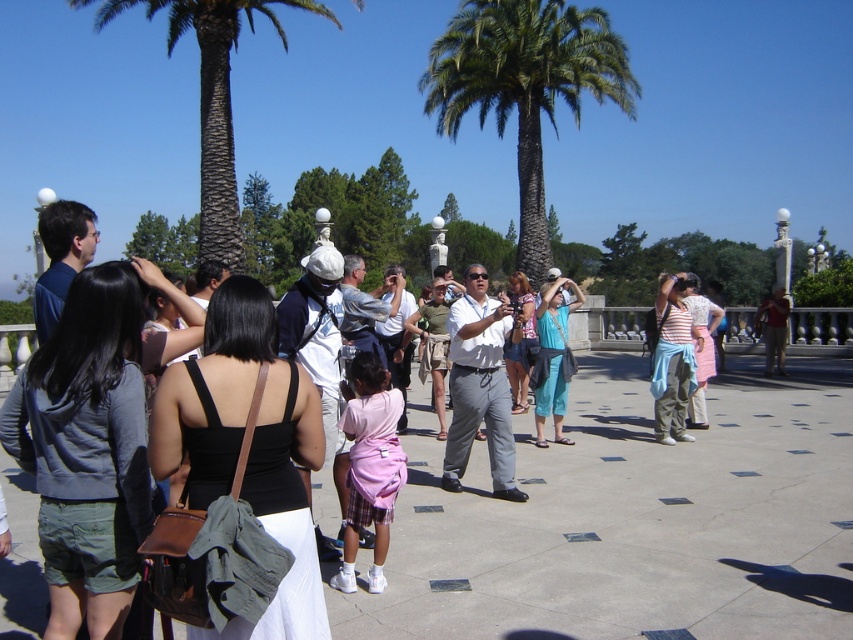
Is green textured palm tree at upper left above matte red shirt at center?

Yes.

What do you see at coordinates (212, 97) in the screenshot? This screenshot has width=853, height=640. I see `green textured palm tree at upper left` at bounding box center [212, 97].

What do you see at coordinates (212, 97) in the screenshot? This screenshot has width=853, height=640. I see `green textured palm tree at upper left` at bounding box center [212, 97].

At what (x,y) coordinates should I click in order to perform the action: click on green textured palm tree at upper left. Please return your answer as a coordinate pair (x, y). The width and height of the screenshot is (853, 640). Looking at the image, I should click on (212, 97).

Does black fabric dress at center appear under matte red shirt at center?

Yes, black fabric dress at center is below matte red shirt at center.

Who is more distant from viewer, (219, 324) or (764, 310)?

The point (764, 310) is more distant.

Identify the location of black fabric dress at center. The image size is (853, 640). (250, 445).

Is matte gray hoodie at center left thinner than striped cotton shirt at center-right?

Incorrect, matte gray hoodie at center left's width is not less than striped cotton shirt at center-right's.

Does point (102, 348) come closer to viewer compared to point (668, 428)?

Yes, it is in front of point (668, 428).

Find the location of a particular element. This screenshot has width=853, height=640. matte gray hoodie at center left is located at coordinates (86, 451).